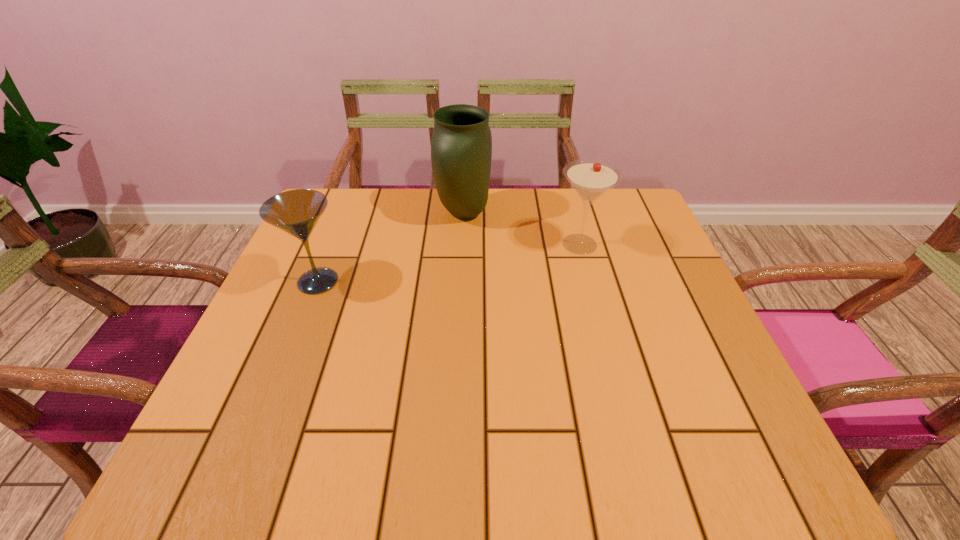
The width and height of the screenshot is (960, 540). What are the coordinates of `the second object from left to right` in the screenshot? It's located at (461, 147).

The image size is (960, 540). Identify the location of the tallest object. (461, 147).

This screenshot has width=960, height=540. Find the location of `the rightmost object`. the rightmost object is located at coordinates (590, 178).

This screenshot has height=540, width=960. Identify the location of the farther martini. (590, 178).

Locate an element on the screen. the leftmost object is located at coordinates (296, 212).

Find the location of a particular element. The image size is (960, 540). the left martini is located at coordinates (296, 212).

Image resolution: width=960 pixels, height=540 pixels. I want to click on vacant region located 0.210m on the front of the tallest object, so click(x=460, y=289).

Where is `free space located 0.060m on the left of the right martini`? The width and height of the screenshot is (960, 540). free space located 0.060m on the left of the right martini is located at coordinates (529, 244).

Identify the location of vacant space located 0.080m on the front of the leftmost object. (299, 330).

You are a GUI agent. You are given a task and a screenshot of the screen. Output one action in this format:
    pyautogui.click(x=<x>, y=<y>)
    Task: Click on the vase that is at the far edge
    The image size is (960, 540).
    Given the screenshot: What is the action you would take?
    pyautogui.click(x=461, y=147)